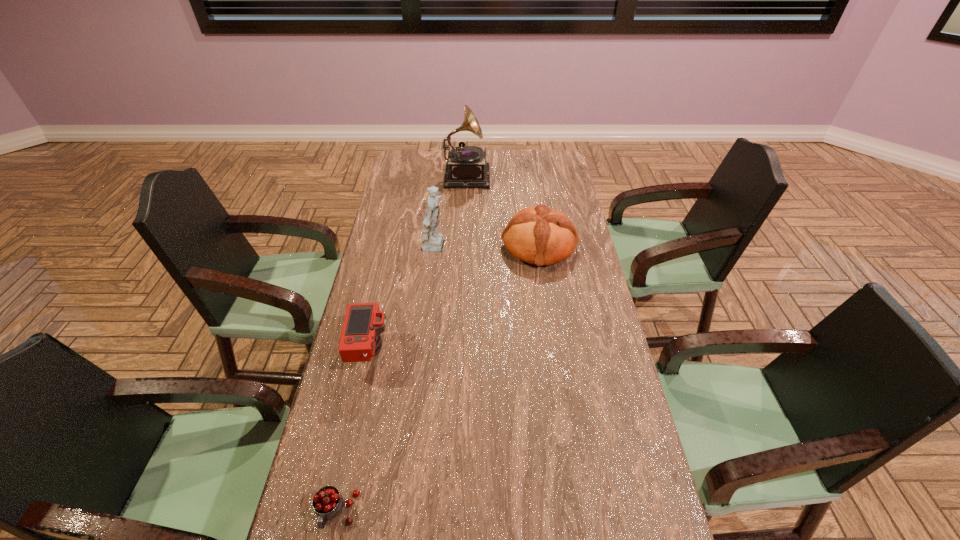
You are a GUI agent. You are given a task and a screenshot of the screen. Output one action in this format:
    pyautogui.click(x=<x>, y=<y>)
    Task: Click on the free spot that satisfies the following two spatial constraints: 1. on the horn of the farthest object; 2. on the back side of the bread
    
    Given the screenshot: What is the action you would take?
    pyautogui.click(x=463, y=246)

This screenshot has width=960, height=540. What are the coordinates of `free space in the image that satisfies the following two spatial constraints: 1. on the horn of the record player; 2. on the back side of the bread` in the screenshot? It's located at click(x=463, y=246).

At what (x,y) coordinates should I click in order to perform the action: click on vacant area that satisfies the following two spatial constraints: 1. on the horn of the record player; 2. on the handle side of the nearest object. Please return your answer as a coordinate pair (x, y). Looking at the image, I should click on (451, 512).

Image resolution: width=960 pixels, height=540 pixels. I want to click on free spot that satisfies the following two spatial constraints: 1. on the horn of the tallest object; 2. on the back side of the rightmost object, so click(x=463, y=246).

This screenshot has height=540, width=960. In order to click on vacant area that satisfies the following two spatial constraints: 1. on the front-facing side of the figurine; 2. on the handle side of the nearest object in this screenshot , I will do `click(407, 512)`.

Where is `free space that satisfies the following two spatial constraints: 1. on the front-facing side of the second tallest object; 2. on the handle side of the cherry`? free space that satisfies the following two spatial constraints: 1. on the front-facing side of the second tallest object; 2. on the handle side of the cherry is located at coordinates (407, 512).